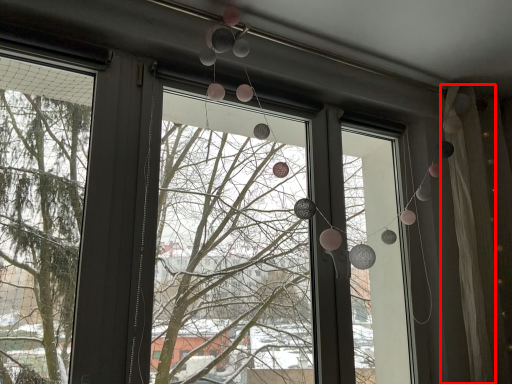
Question: From the image's perspective, what is the correct spatial positioning of curtain (annotated by the red box) in reference to shop window?

Choices:
 (A) below
 (B) above

Answer: (A)